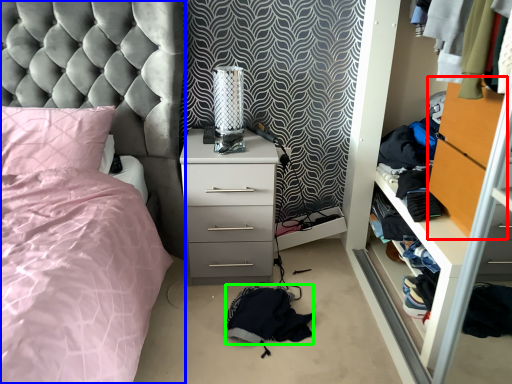
Question: Which is farther away from file cabinet (highlighted by a red box)? bed (highlighted by a blue box) or clothing (highlighted by a green box)?

Choices:
 (A) bed
 (B) clothing

Answer: (A)